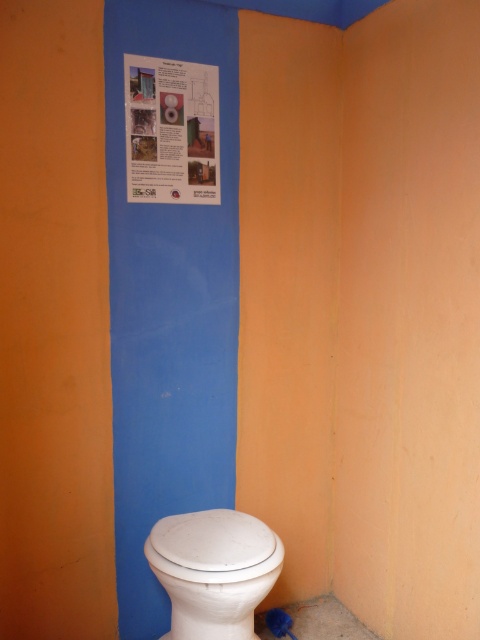
In the scene shown: You are standing in the bathroom stall and want to clean both the white glossy toilet at lower right and the matte paper poster at upper center. Which object should you reach for first to start cleaning?

You should start by cleaning the white glossy toilet at lower right because it is closer to you than the matte paper poster at upper center.

Looking at this image, you are standing in the bathroom stall and need to locate the white glossy toilet at lower right. According to the coordinates provided, where exactly is it positioned?

The white glossy toilet at lower right is located at point (214, 570), which means it is positioned near the lower right corner of the stall.

You are a maintenance worker inspecting the bathroom stall. You need to clean both the white glossy toilet at lower right and the matte paper poster at upper center. Which object should you clean first if you want to start from the lowest point and work upwards?

You should clean the white glossy toilet at lower right first because it is located below the matte paper poster at upper center, allowing you to start from the lowest point and move upwards.